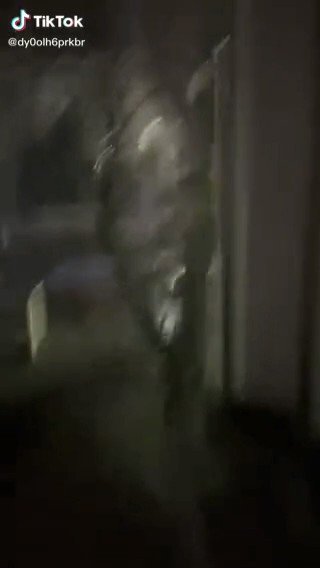
Locate an element on the screen. This screenshot has height=568, width=320. wall is located at coordinates (271, 225).